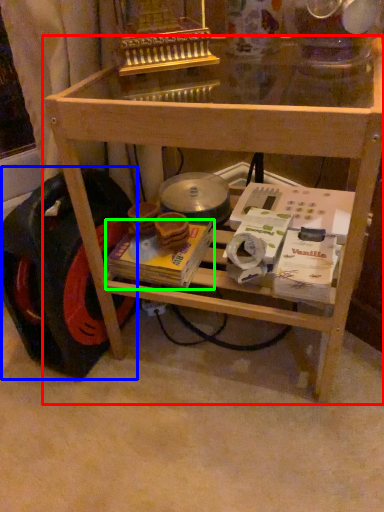
Question: Considering the real-world distances, which object is farthest from table (highlighted by a red box)? wheel (highlighted by a blue box) or magazine (highlighted by a green box)?

Choices:
 (A) wheel
 (B) magazine

Answer: (B)